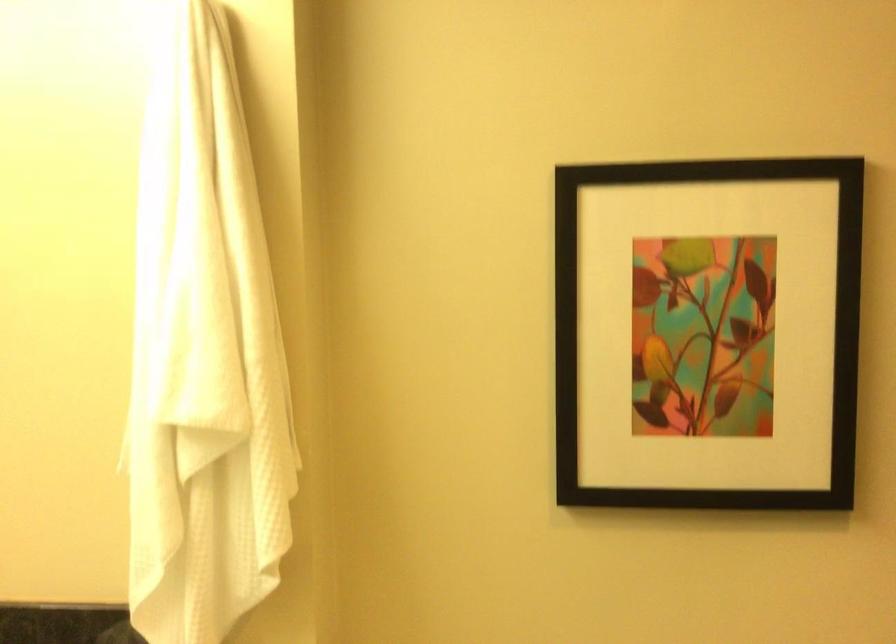
Where would you lift the white hanging towel? Please return your answer as a coordinate pair (x, y).

(279, 267)